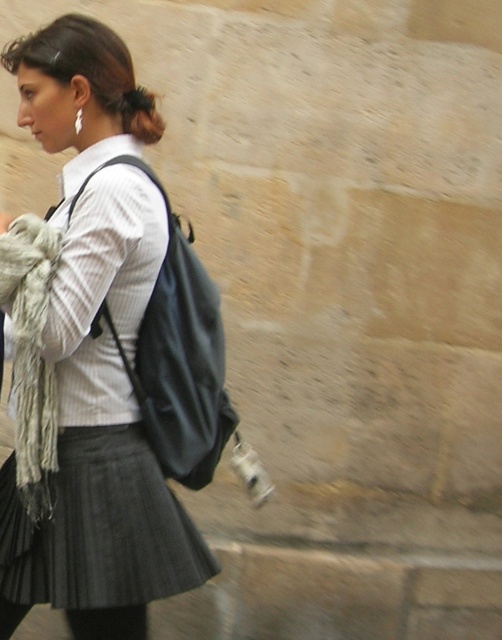
Can you confirm if matte black backpack at center is positioned below dark brown hair at upper center?

Yes, matte black backpack at center is below dark brown hair at upper center.

Looking at this image, can you confirm if matte black backpack at center is taller than dark brown hair at upper center?

Indeed, matte black backpack at center has a greater height compared to dark brown hair at upper center.

Identify the location of matte black backpack at center. The image size is (502, 640). (100, 438).

This screenshot has height=640, width=502. In order to click on matte black backpack at center in this screenshot , I will do `click(100, 438)`.